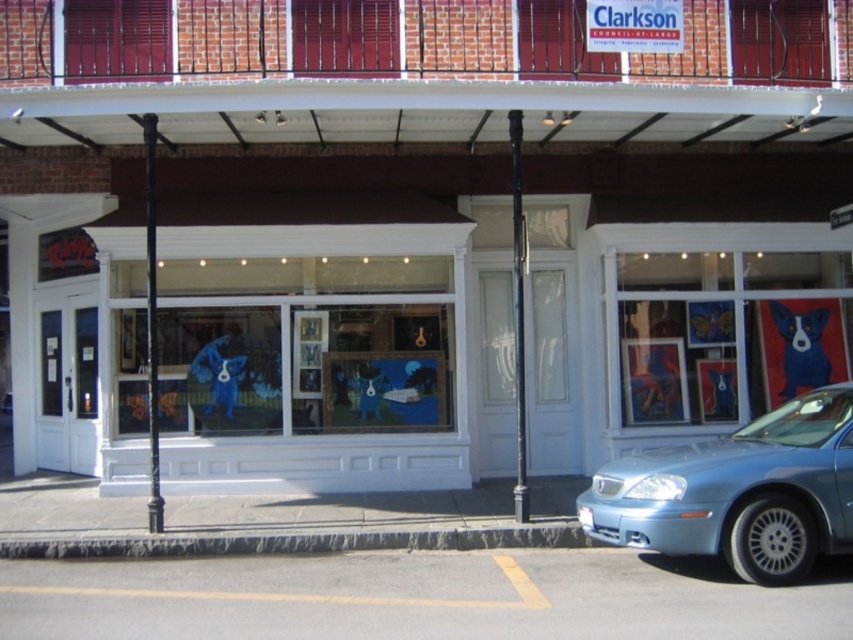
You are standing in front of the storefront and want to take a photo of the blue glossy dog at center without the light blue metallic car at lower right appearing in the frame. Is it possible to do so by moving closer to the dog?

The light blue metallic car at lower right is closer to the viewer than the blue glossy dog at center. Moving closer to the dog would bring it into a position where the car might still block the view unless you move sideways. However, since the car is closer, adjusting your angle or moving to the side away from the car could allow you to frame the dog without the car in the shot.

You are a delivery driver who needs to park your light blue metallic car at lower right as close as possible to the matte glass window at center without blocking the entrance. What is the minimum distance you can park the car from the window?

The matte glass window at center is 4.16 meters from the light blue metallic car at lower right, so the minimum distance you can park the car from the window is 4.16 meters.

You are a delivery person trying to park your 1.8 meters tall delivery cart in the parking spot near the light blue metallic car at lower right. The blue glossy dog at center is blocking the path. Can you safely park your cart there without knocking over the dog?

The light blue metallic car at lower right is not as tall as the blue glossy dog at center, so the dog is taller than the car. Since the delivery cart is 1.8 meters tall, it might hit the dog if parked there. Therefore, you should avoid parking the cart near the light blue metallic car at lower right to prevent knocking over the blue glossy dog at center.